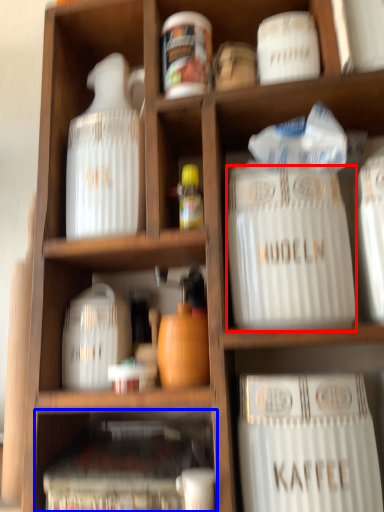
Question: Which point is further to the camera, type (highlighted by a red box) or cabinet (highlighted by a blue box)?

Choices:
 (A) type
 (B) cabinet

Answer: (A)